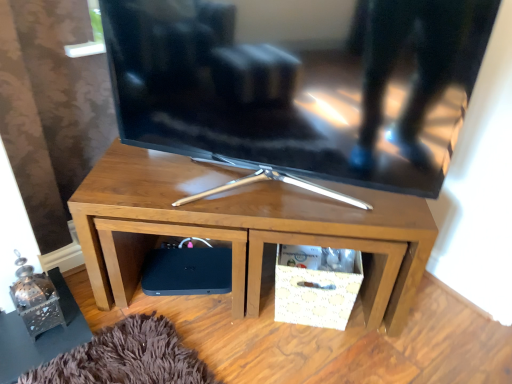
Question: In terms of width, does wooden tv stand at center look wider or thinner when compared to black matte speaker at lower left?

Choices:
 (A) thin
 (B) wide

Answer: (B)

Question: In the image, is wooden tv stand at center positioned in front of or behind black matte speaker at lower left?

Choices:
 (A) front
 (B) behind

Answer: (A)

Question: Considering the real-world distances, which object is closest to the matte black tv at center?

Choices:
 (A) wooden tv stand at center
 (B) black matte speaker at lower left

Answer: (A)

Question: Which object is positioned closest to the black matte speaker at lower left?

Choices:
 (A) matte black tv at center
 (B) wooden tv stand at center

Answer: (B)